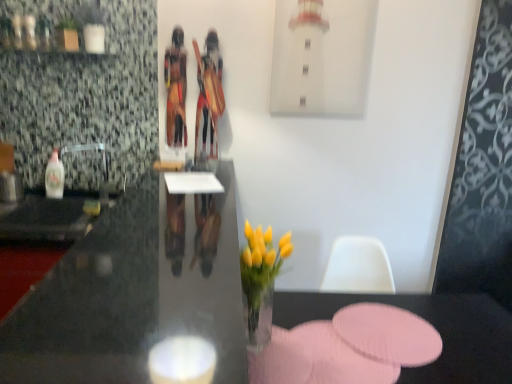
Question: Is black glossy desk at center taller or shorter than wooden tribal figure at center, which appears as the first person when viewed from the right?

Choices:
 (A) tall
 (B) short

Answer: (B)

Question: Would you say black glossy desk at center is inside or outside wooden tribal figure at center, which appears as the first person when viewed from the right?

Choices:
 (A) outside
 (B) inside

Answer: (A)

Question: Which object is positioned farthest from the pink fabric placemat at lower center?

Choices:
 (A) wooden tribal figure at center, the second person positioned from the right
 (B) translucent plastic bottle at left
 (C) black glossy desk at center
 (D) wooden tribal figure at center, which appears as the first person when viewed from the right

Answer: (B)

Question: Estimate the real-world distances between objects in this image. Which object is closer to the wooden tribal figure at center, the second person positioned from the right?

Choices:
 (A) pink fabric placemat at lower center
 (B) translucent plastic bottle at left
 (C) black glossy desk at center
 (D) wooden tribal figure at center, which appears as the first person when viewed from the right

Answer: (D)